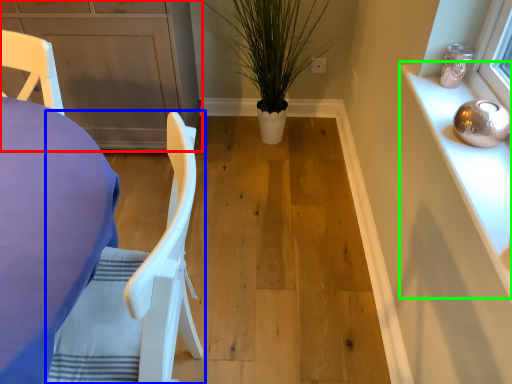
Question: Which is farther away from cabinetry (highlighted by a red box)? chair (highlighted by a blue box) or cabinetry (highlighted by a green box)?

Choices:
 (A) chair
 (B) cabinetry

Answer: (B)